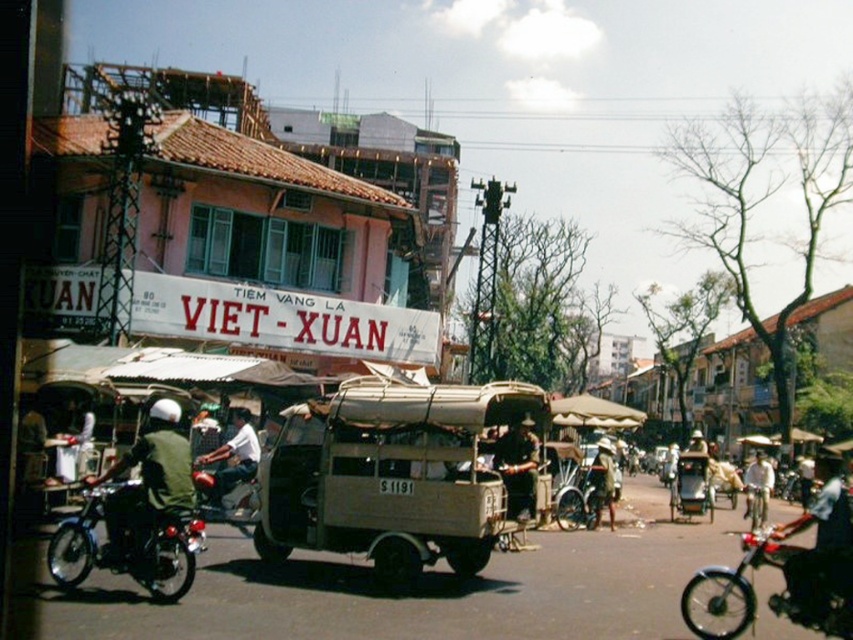
Is point (843, 602) in front of point (611, 490)?

That is True.

Is point (819, 531) positioned behind point (593, 460)?

No, (819, 531) is in front of (593, 460).

Who is more distant from viewer, (844, 563) or (608, 504)?

The point (608, 504) is behind.

This screenshot has height=640, width=853. What are the coordinates of `dark blue jeans at lower right` in the screenshot? It's located at (822, 545).

Is shiny black motorcycle at lower left further to camera compared to light brown leather helmet at center?

No.

Between shiny black motorcycle at lower left and light brown leather helmet at center, which one appears on the left side from the viewer's perspective?

shiny black motorcycle at lower left

Which is behind, point (106, 497) or point (604, 436)?

Point (604, 436)

Locate an element on the screen. shiny black motorcycle at lower left is located at coordinates (126, 545).

At what (x,y) coordinates should I click in order to perform the action: click on light brown leather jacket at center-left. Please return your answer as a coordinate pair (x, y). Looking at the image, I should click on (231, 464).

Who is shorter, light brown leather jacket at center-left or light brown leather helmet at center?

light brown leather jacket at center-left

Is point (242, 426) less distant than point (601, 444)?

Yes, it is.

This screenshot has width=853, height=640. Identify the location of light brown leather jacket at center-left. (231, 464).